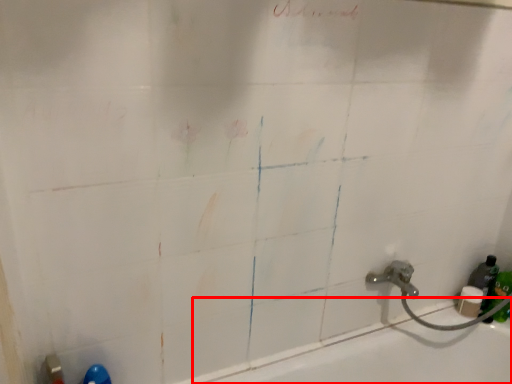
Question: From the image's perspective, what is the correct spatial relationship of bath (annotated by the red box) in relation to bottle?

Choices:
 (A) below
 (B) above

Answer: (A)